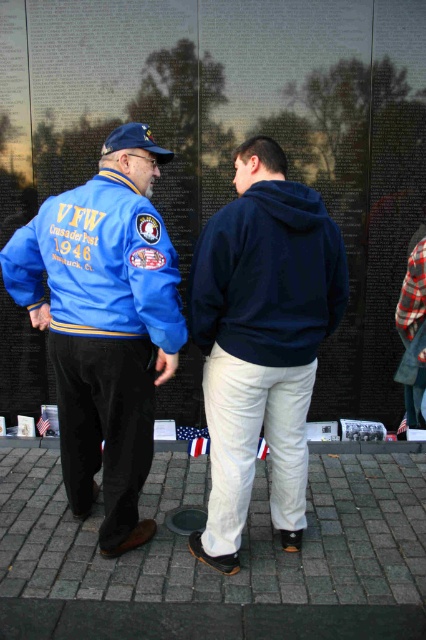
Based on the scene description, if you were standing where the blue leather jacket at left is positioned, would the american flag at center be visible to you? Explain your reasoning using the spatial relationships provided.

The blue leather jacket at left is above the american flag at center, so if you were standing where the jacket is, the flag would likely be visible below it. Since the jacket is positioned higher up, the flag at center should be in your line of sight unless blocked by the jacket itself or another object.

You are a tour guide leading a group at the memorial. You need to ensure visitors maintain a minimum distance of 6 feet from the American flag at center. A visitor wearing a blue fabric baseball cap at left is currently standing near the flag. Is the visitor complying with the distance requirement?

The distance between the blue fabric baseball cap at left and the American flag at center is 7.06 feet, which exceeds the required 6 feet minimum distance. Therefore, the visitor is complying with the distance requirement.